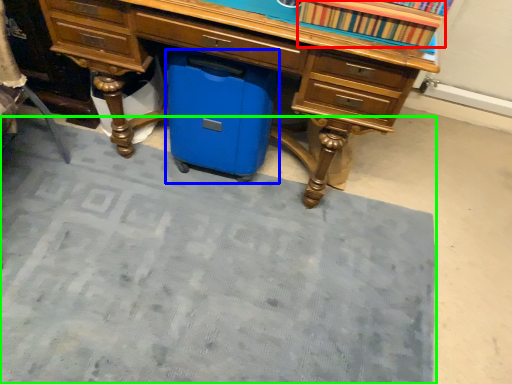
Question: Estimate the real-world distances between objects in this image. Which object is closer to book (highlighted by a red box), cooler (highlighted by a blue box) or doormat (highlighted by a green box)?

Choices:
 (A) cooler
 (B) doormat

Answer: (A)